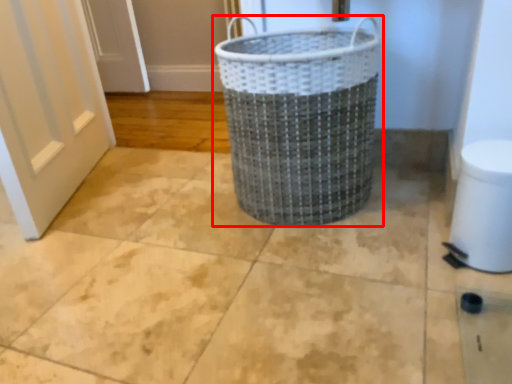
Question: From the image's perspective, considering the relative positions of waste container (annotated by the red box) and toilet bowl in the image provided, where is waste container (annotated by the red box) located with respect to the staircase?

Choices:
 (A) above
 (B) below

Answer: (A)